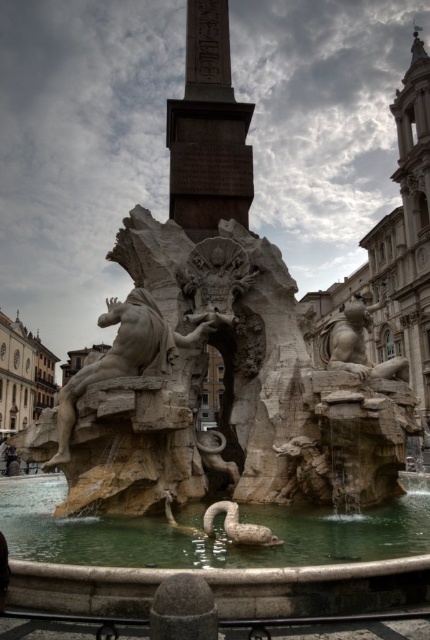
You are a tour guide leading a group around Piazza Navona. You want to ensure everyone can see both the stone statue at center and the smooth stone lion at right without moving too far. Given that the average person can see clearly within 200 feet, is this possible?

The stone statue at center and smooth stone lion at right are 258.83 feet apart, which exceeds the 200 feet viewing range. Therefore, the group would need to move closer to see both clearly without straining.

You are an art student visiting the Piazza Navona fountain. You notice the stone statue at center and the smooth stone lion at right. Based on their positions, which one is higher up?

The stone statue at center is located above the smooth stone lion at right, so it is higher up.